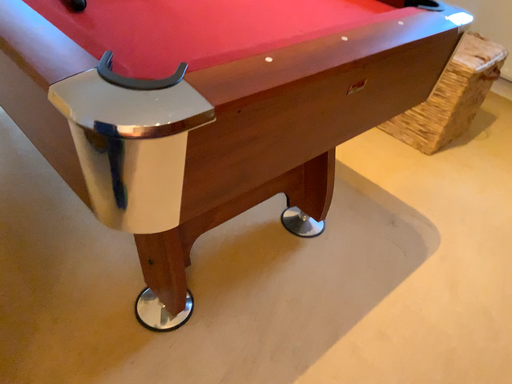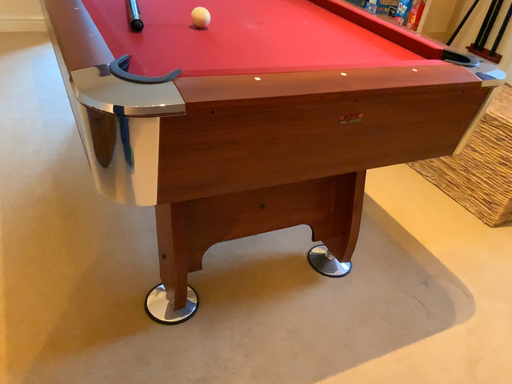
Question: Which way did the camera rotate in the video?

Choices:
 (A) rotated left
 (B) rotated right

Answer: (A)